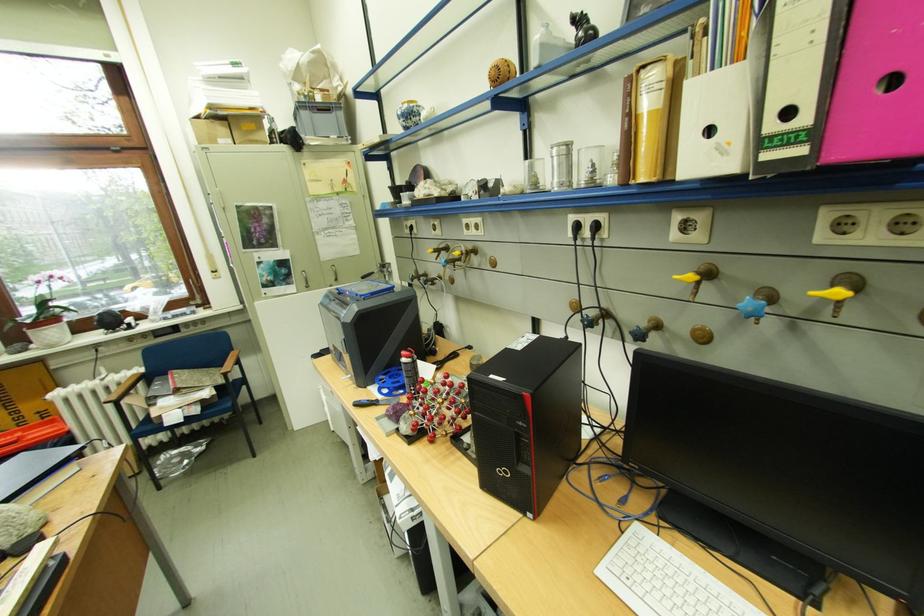
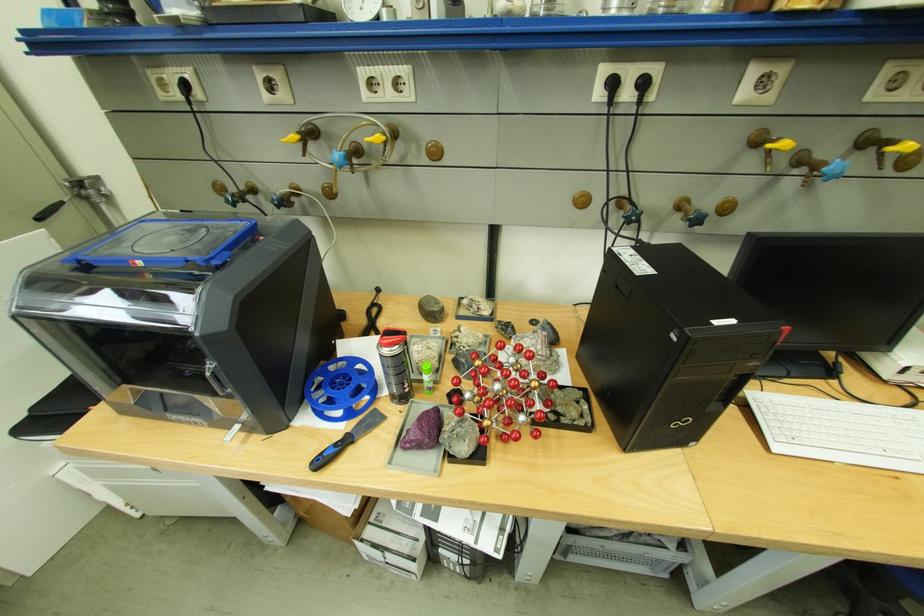
Find the pixel in the second image that matches point 419,426 in the first image.

(480, 440)